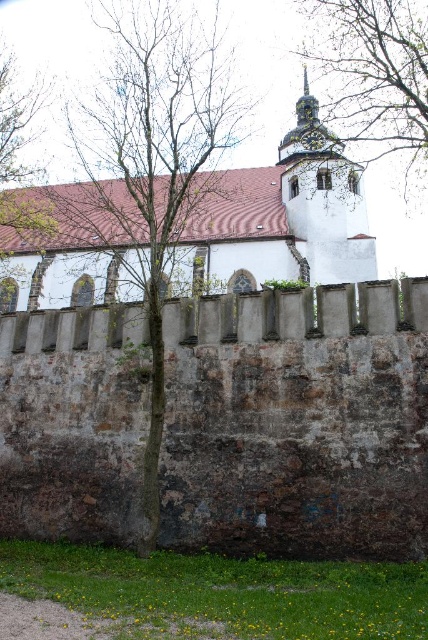
You are standing in the churchyard looking at the historic stone wall. You see a brown bark tree at center and a green leafy tree at left. Which tree is closer to the wall?

The brown bark tree at center is closer to the wall because it is positioned below the green leafy tree at left, indicating it is in front of the wall.

You are standing in the churchyard and want to take a photo of both the brown bark tree at center and the green leafy tree at left. Which tree should you position yourself closer to in order to capture both in the frame?

You should position yourself closer to the green leafy tree at left because the brown bark tree at center is to the right of it, allowing both trees to be included in the frame when centered on the left tree.

Based on the photo, you are a bird looking for a place to perch. You see a brown bark tree at center and a green leafy tree at upper right. Which tree would you choose if you want to perch higher above the ground?

The green leafy tree at upper right is higher than the brown bark tree at center, so you should choose the green leafy tree at upper right to perch higher above the ground.